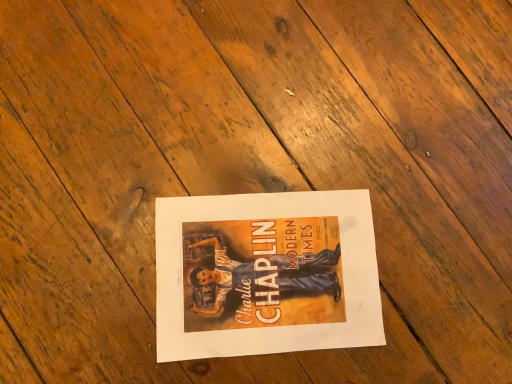
This screenshot has width=512, height=384. In order to click on matte paper poster at center in this screenshot , I will do `click(266, 274)`.

The height and width of the screenshot is (384, 512). What do you see at coordinates (266, 274) in the screenshot?
I see `matte paper poster at center` at bounding box center [266, 274].

What are the coordinates of `matte paper poster at center` in the screenshot? It's located at (266, 274).